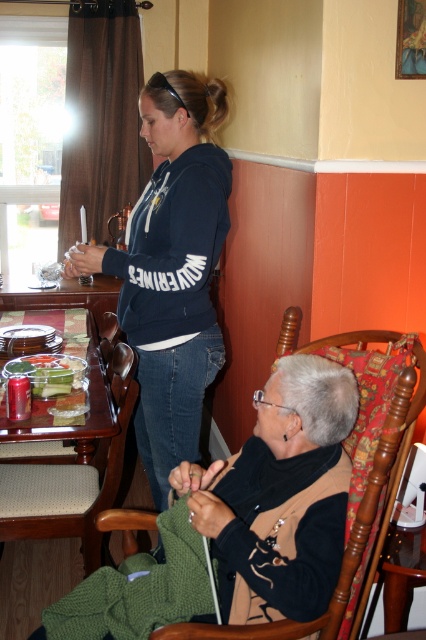
Question: Among these objects, which one is nearest to the camera?

Choices:
 (A) dark blue hoodie at center
 (B) clear glass tray at lower left

Answer: (A)

Question: Can you confirm if dark blue hoodie at center is positioned above green plastic container at left?

Choices:
 (A) no
 (B) yes

Answer: (B)

Question: Based on their relative distances, which object is nearer to the dark blue hoodie at center?

Choices:
 (A) green plastic container at left
 (B) clear glass tray at lower left
 (C) brown wood chair at lower left

Answer: (C)

Question: Can you confirm if brown wood chair at lower left is wider than green plastic container at left?

Choices:
 (A) no
 (B) yes

Answer: (B)

Question: Among these objects, which one is farthest from the camera?

Choices:
 (A) dark blue hoodie at center
 (B) brown wood chair at lower left
 (C) green plastic container at left

Answer: (C)

Question: Is brown wood chair at lower left bigger than clear glass tray at lower left?

Choices:
 (A) no
 (B) yes

Answer: (A)